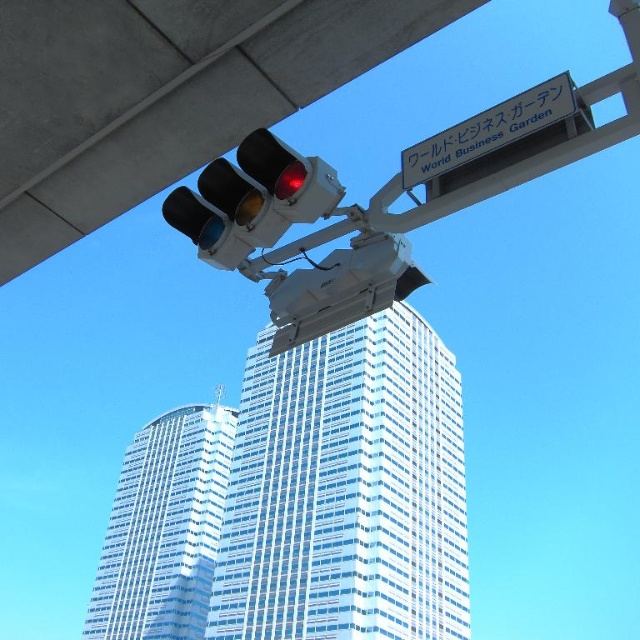
Does white glass building at center have a larger size compared to matte black traffic light at upper center?

Yes.

Is point (342, 547) positioned behind point (237, 186)?

Yes, point (342, 547) is farther from viewer.

Identify the location of white glass building at center. The image size is (640, 640). (346, 490).

Is point (211, 609) positioned behind point (403, 157)?

Yes, point (211, 609) is behind point (403, 157).

Does white glass building at center have a lesser width compared to white plastic sign at upper center?

Incorrect, white glass building at center's width is not less than white plastic sign at upper center's.

Does point (344, 518) come behind point (497, 132)?

That is True.

The image size is (640, 640). I want to click on white glass building at center, so click(x=346, y=490).

Image resolution: width=640 pixels, height=640 pixels. What do you see at coordinates (346, 490) in the screenshot?
I see `white glass building at center` at bounding box center [346, 490].

Is white glass building at center to the left of white glass building at lower left from the viewer's perspective?

No, white glass building at center is not to the left of white glass building at lower left.

What do you see at coordinates (346, 490) in the screenshot?
I see `white glass building at center` at bounding box center [346, 490].

You are a GUI agent. You are given a task and a screenshot of the screen. Output one action in this format:
    pyautogui.click(x=<x>, y=<y>)
    Task: Click on the white glass building at center
    
    Given the screenshot: What is the action you would take?
    pyautogui.click(x=346, y=490)